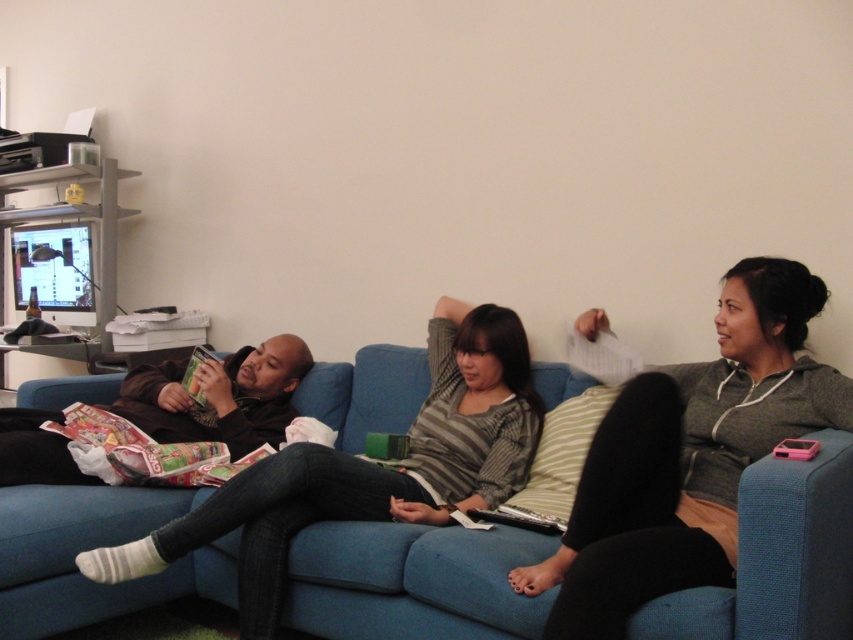
Question: Which is farther from the matte brown jacket at center?

Choices:
 (A) striped sweater at center
 (B) gray fleece hoodie at right

Answer: (B)

Question: Does gray fleece hoodie at right have a smaller size compared to matte green magazine at center?

Choices:
 (A) yes
 (B) no

Answer: (B)

Question: Which point is farther to the camera?

Choices:
 (A) gray fleece hoodie at right
 (B) matte brown jacket at center

Answer: (B)

Question: Is matte brown jacket at center in front of matte green magazine at center?

Choices:
 (A) no
 (B) yes

Answer: (B)

Question: Does matte brown jacket at center have a greater width compared to matte green magazine at center?

Choices:
 (A) no
 (B) yes

Answer: (B)

Question: Which point is closer to the camera?

Choices:
 (A) striped sweater at center
 (B) matte brown jacket at center

Answer: (A)